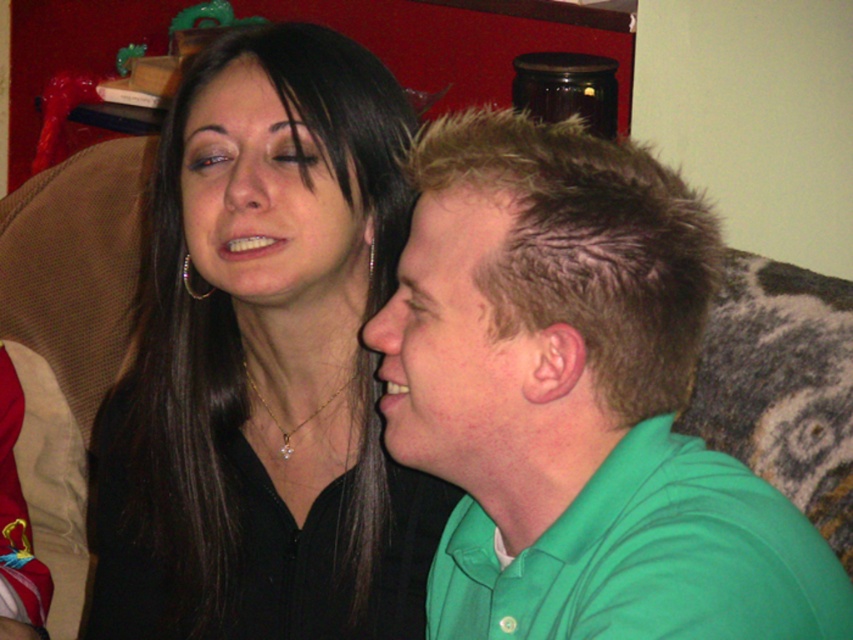
You are an interior designer analyzing the seating arrangement in the image. You notice the black matte hair at upper left and the matte black face at upper left. Which object is positioned to the left of the other?

The black matte hair at upper left is to the left of the matte black face at upper left, so the black matte hair at upper left is positioned to the left of the matte black face at upper left.

What are the exact coordinates of the black matte hair at upper left in the image?

The black matte hair at upper left is located at coordinates point (264, 364).

You are an interior designer assessing the placement of decorative items in a living room. You notice the black matte hair at upper left and the silver metallic hoop at upper left. Which object takes up more space in the scene?

The black matte hair at upper left takes up more space in the scene because it is bigger than the silver metallic hoop at upper left according to the description.